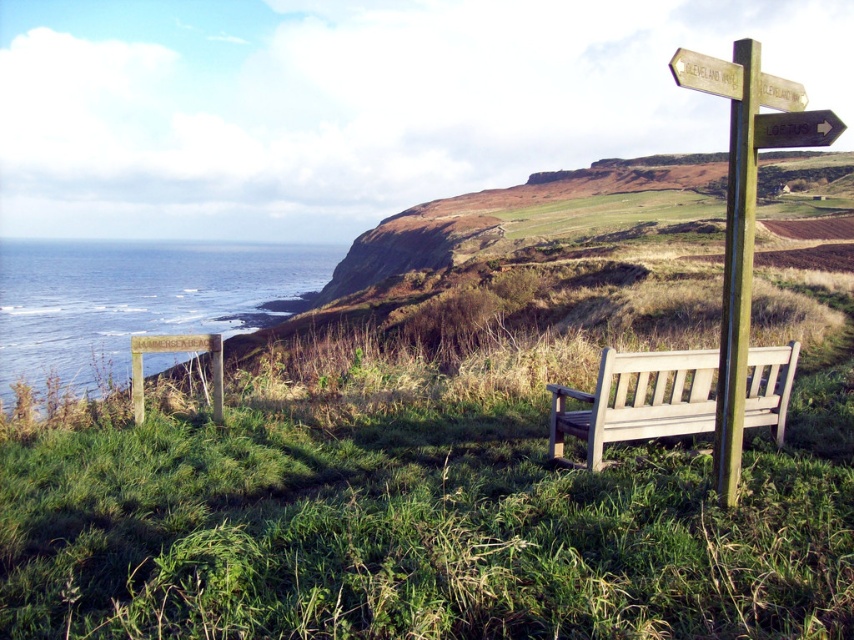
Question: Which point is closer to the camera taking this photo?

Choices:
 (A) (276, 289)
 (B) (728, 262)

Answer: (B)

Question: Can you confirm if blue water at left is wider than wooden signpost at right?

Choices:
 (A) no
 (B) yes

Answer: (B)

Question: Which point appears farthest from the camera in this image?

Choices:
 (A) (32, 257)
 (B) (771, 90)

Answer: (A)

Question: Is blue water at left smaller than black plastic arrow at upper right?

Choices:
 (A) no
 (B) yes

Answer: (A)

Question: Is wooden signpost at center-right to the right of wooden bench at right from the viewer's perspective?

Choices:
 (A) no
 (B) yes

Answer: (B)

Question: Which point is closer to the camera?

Choices:
 (A) (734, 324)
 (B) (735, 349)

Answer: (A)